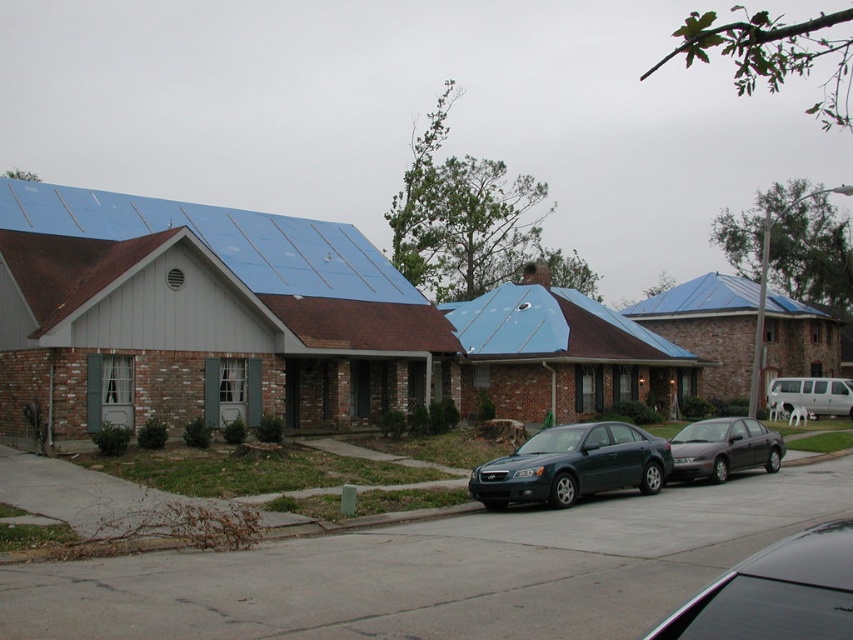
Between blue metallic roof at center and blue metallic roof at upper center, which one has less height?

blue metallic roof at upper center

Is blue metallic roof at center in front of blue metallic roof at upper center?

That is True.

What are the coordinates of `blue metallic roof at center` in the screenshot? It's located at (x=553, y=326).

Who is shorter, matte black sedan at center or metallic gray sedan at center?

matte black sedan at center is shorter.

This screenshot has width=853, height=640. What do you see at coordinates (573, 465) in the screenshot? I see `matte black sedan at center` at bounding box center [573, 465].

Identify the location of matte black sedan at center. (573, 465).

Between blue metallic roof at center and metallic gray sedan at center, which one appears on the left side from the viewer's perspective?

blue metallic roof at center is more to the left.

Between blue metallic roof at center and metallic gray sedan at center, which one is positioned higher?

blue metallic roof at center

Is point (511, 285) closer to camera compared to point (706, 426)?

No.

In order to click on blue metallic roof at center in this screenshot , I will do `click(553, 326)`.